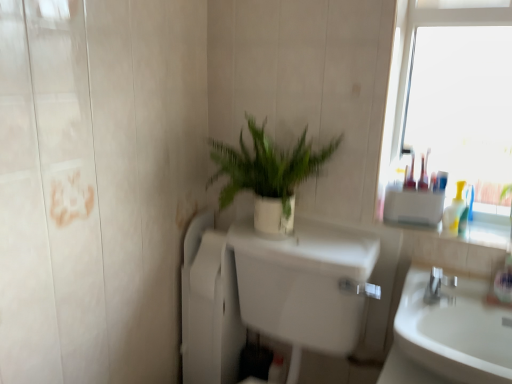
You are a GUI agent. You are given a task and a screenshot of the screen. Output one action in this format:
    pyautogui.click(x=<x>, y=<y>)
    Task: Click on the vacant space underneath white matte plant pot at center (from a real-world perspective)
    
    Given the screenshot: What is the action you would take?
    pyautogui.click(x=275, y=237)